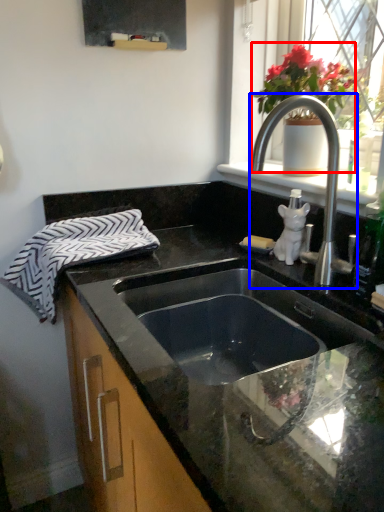
Question: Which object is closer to the camera taking this photo, floral arrangement (highlighted by a red box) or tap (highlighted by a blue box)?

Choices:
 (A) floral arrangement
 (B) tap

Answer: (B)